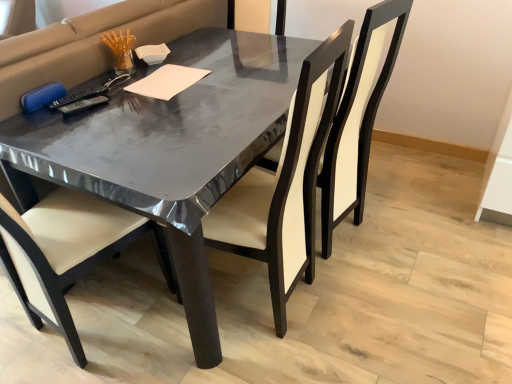
In order to click on vacant position to the left of white paper at center in this screenshot , I will do `click(109, 89)`.